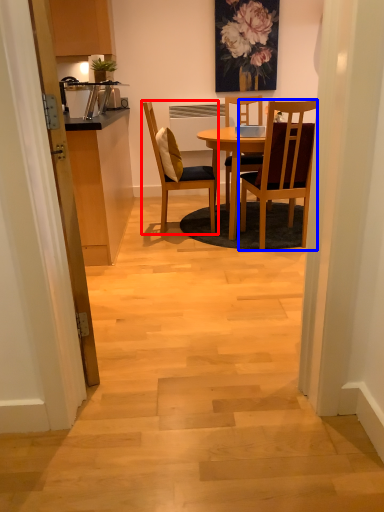
Question: Which point is further to the camera, chair (highlighted by a red box) or chair (highlighted by a blue box)?

Choices:
 (A) chair
 (B) chair

Answer: (A)